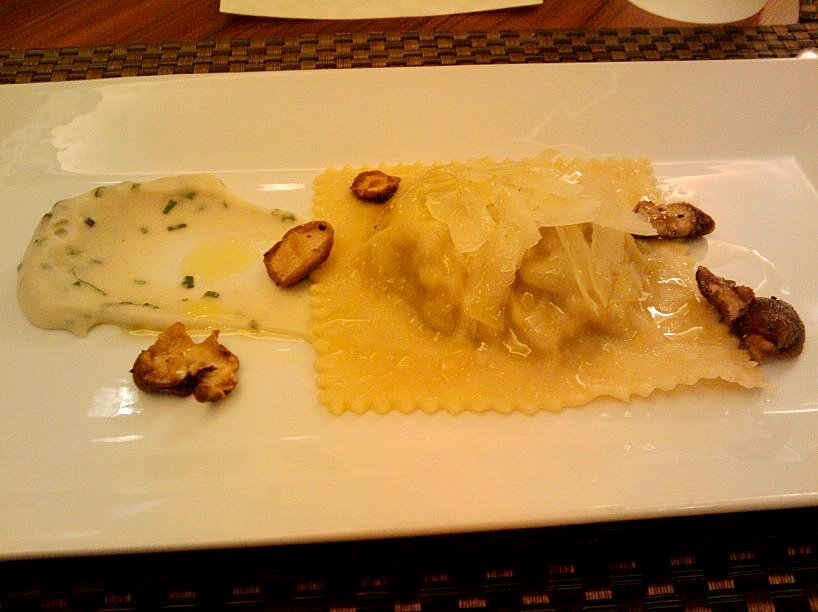
Identify the location of receipt or piece of paper on the table. The image size is (818, 612). (366, 10).